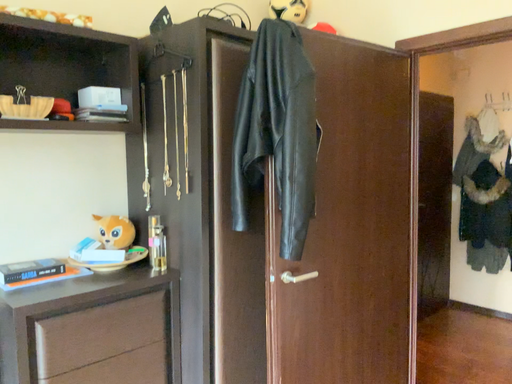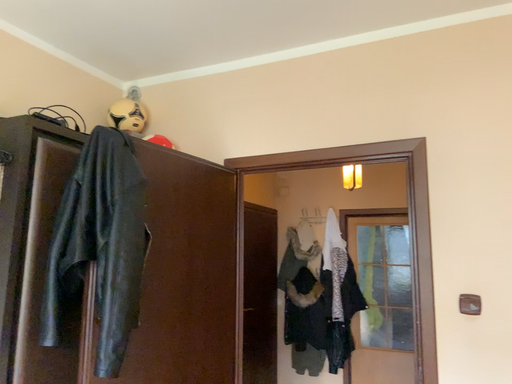
Question: How did the camera likely rotate when shooting the video?

Choices:
 (A) rotated upward
 (B) rotated downward

Answer: (A)